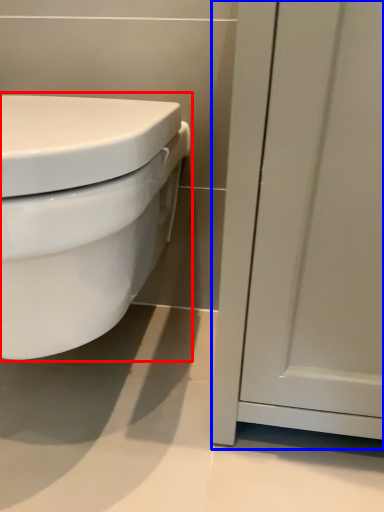
Question: Among these objects, which one is nearest to the camera, toilet (highlighted by a red box) or screen door (highlighted by a blue box)?

Choices:
 (A) toilet
 (B) screen door

Answer: (A)